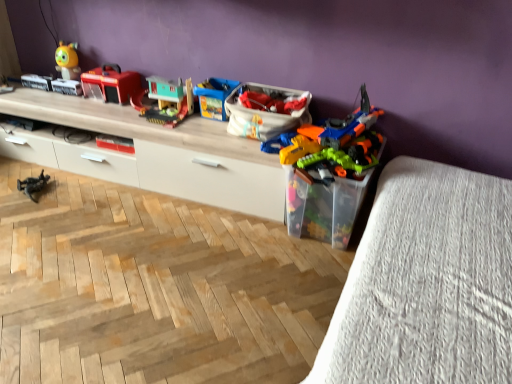
Where is `vacant space to the left of translucent plastic storage box at center-right, which is the 2th storage box from top to bottom`? This screenshot has width=512, height=384. vacant space to the left of translucent plastic storage box at center-right, which is the 2th storage box from top to bottom is located at coordinates (246, 233).